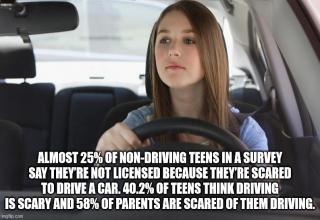
Where is `mirror`? mirror is located at coordinates (56, 21).